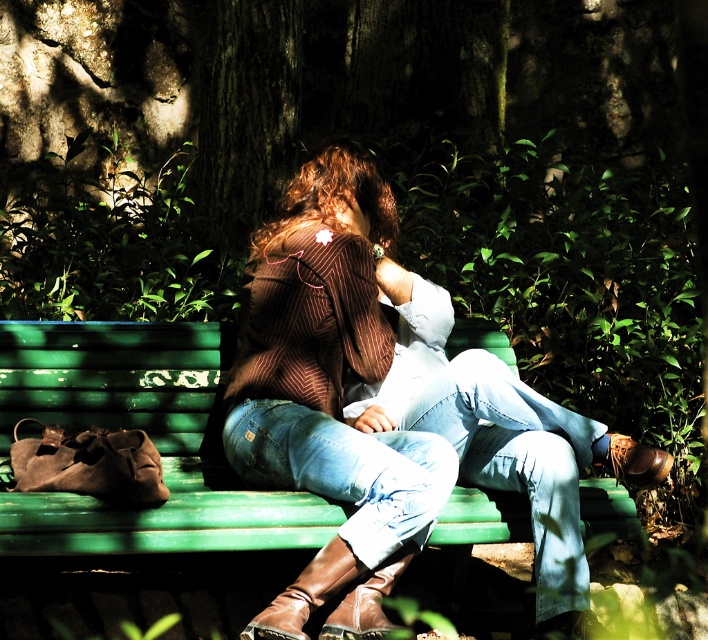
From the picture: Between brown striped sweater at center and green painted wood bench at center, which one appears on the right side from the viewer's perspective?

From the viewer's perspective, brown striped sweater at center appears more on the right side.

Is brown striped sweater at center above green painted wood bench at center?

Indeed, brown striped sweater at center is positioned over green painted wood bench at center.

Between point (590, 440) and point (285, 522), which one is positioned in front?

Positioned in front is point (285, 522).

Where is `brown striped sweater at center`? The height and width of the screenshot is (640, 708). brown striped sweater at center is located at coordinates (389, 404).